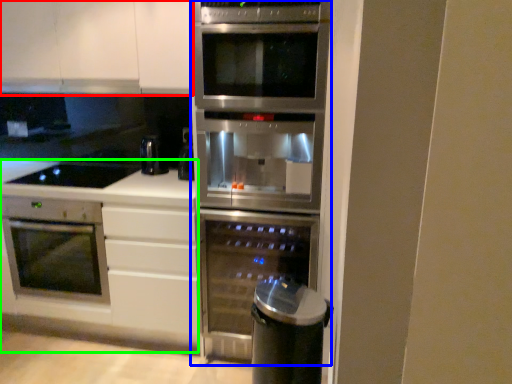
Question: Which is farther away from cabinetry (highlighted by a red box)? fridge (highlighted by a blue box) or counter (highlighted by a green box)?

Choices:
 (A) fridge
 (B) counter

Answer: (B)